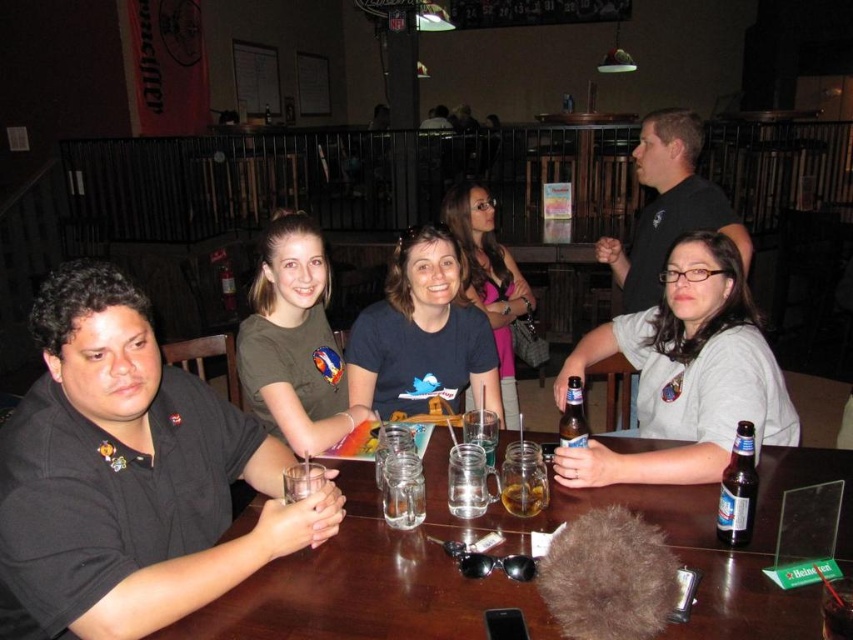
You are a photographer trying to capture a group photo of the black shirt at left and the matte blue shirt at center. Since you want to ensure both are clearly visible, you need to know which shirt is wider. Can you tell me which one is wider?

The black shirt at left is wider than the matte blue shirt at center.

You are a server at the bar. You need to place a new drink order on the table. Which object, the transparent glass table at center or the dark brown glass bottle at table right, should you place the drink on to ensure it is higher than the bottle?

You should place the drink on the transparent glass table at center because it is shorter than the dark brown glass bottle at table right, so the drink will be higher.

You are a photographer taking a photo of the black shirt at left and the matte blue shirt at center. To ensure both shirts are fully visible in the frame, which shirt should you adjust to move upwards?

The black shirt at left is positioned under the matte blue shirt at center. To ensure both shirts are fully visible in the frame, you should adjust the black shirt at left to move upwards so it doesn